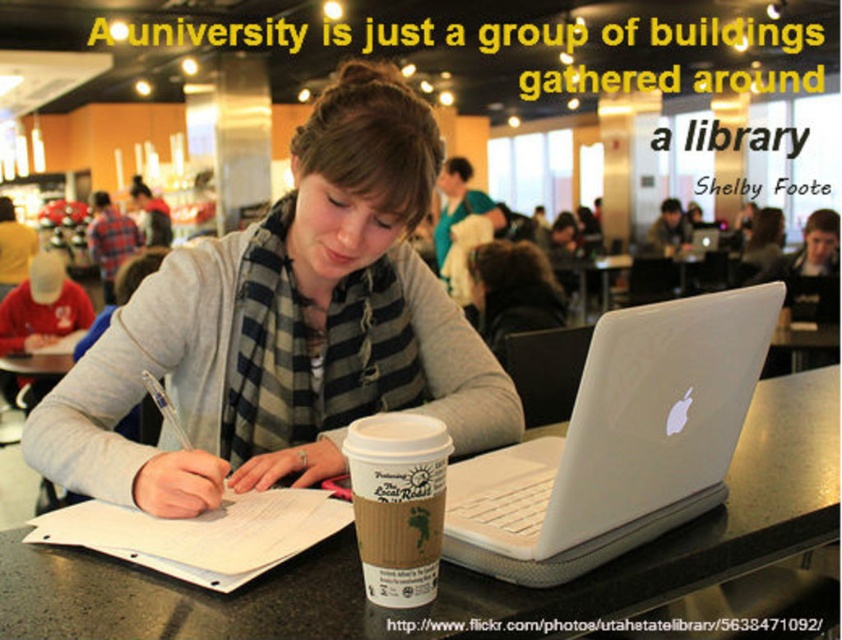
Question: Is white paper at center thinner than plaid scarf at center?

Choices:
 (A) yes
 (B) no

Answer: (A)

Question: Which point is closer to the camera?

Choices:
 (A) (372, 516)
 (B) (550, 534)
 (C) (345, 500)

Answer: (A)

Question: Which point is farther to the camera?

Choices:
 (A) white paper at center
 (B) black plastic table at center

Answer: (A)

Question: Which of these objects is positioned farthest from the gray wool scarf at center?

Choices:
 (A) white plastic laptop at center
 (B) plaid scarf at center

Answer: (B)

Question: Is white plastic laptop at center closer to camera compared to white paper at center?

Choices:
 (A) no
 (B) yes

Answer: (B)

Question: In this image, where is white plastic laptop at center located relative to brown paper cup at center?

Choices:
 (A) above
 (B) below

Answer: (A)